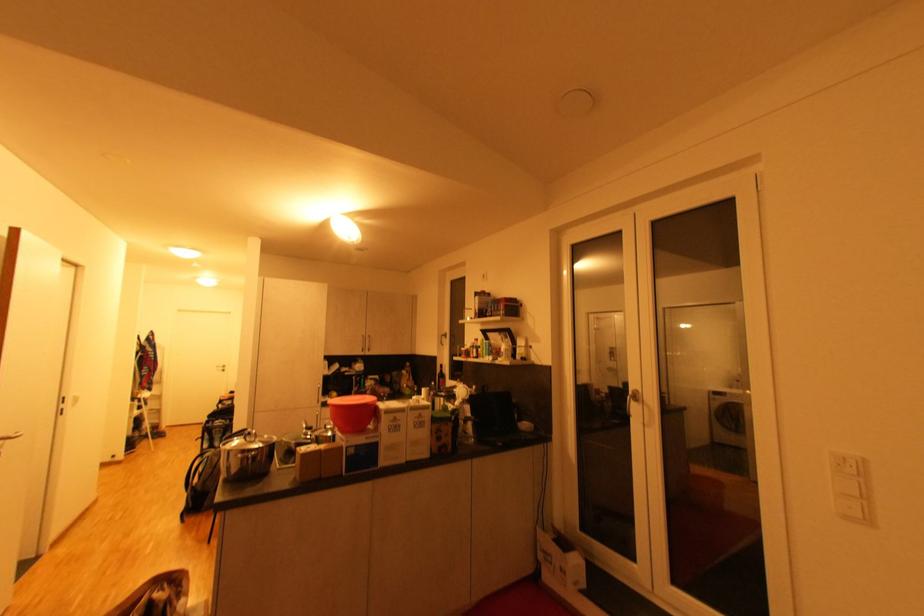
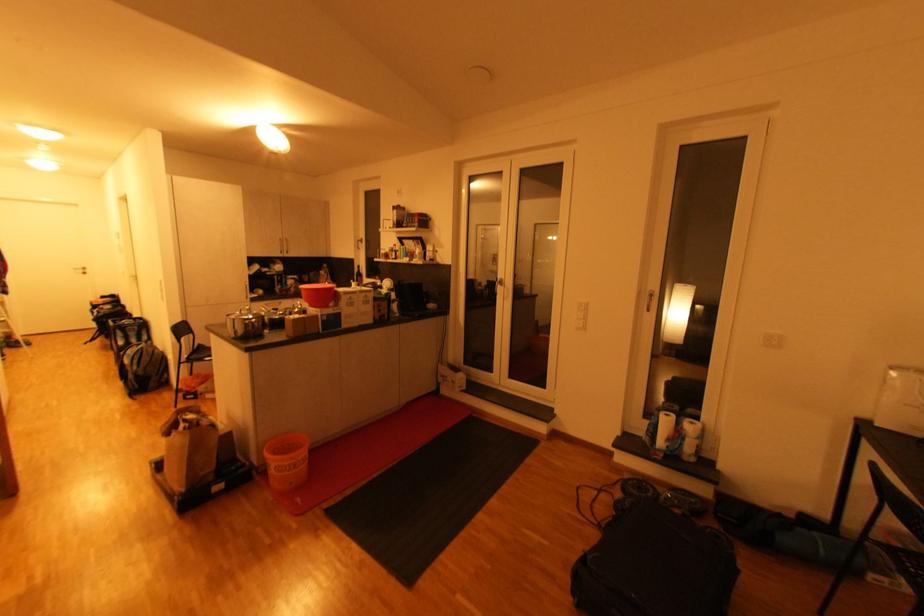
Find the pixel in the second image that matches point 237,472 in the first image.

(245, 334)